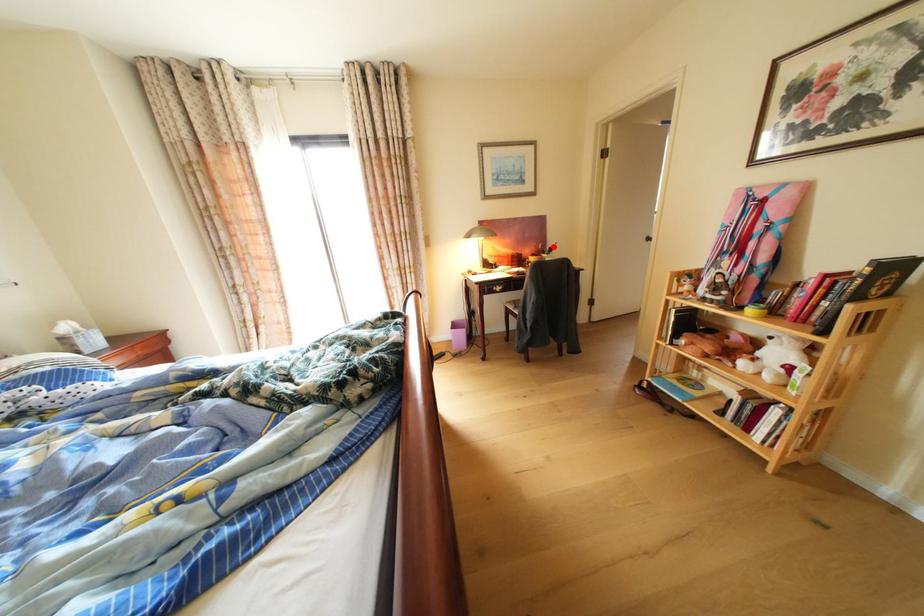
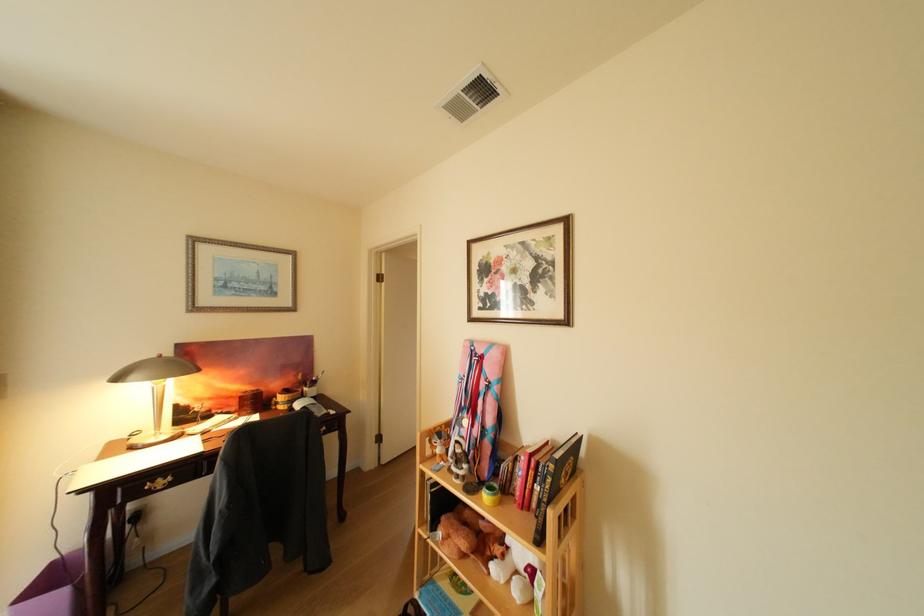
Question: I am providing you with two images of the same scene from different viewpoints. A red point is marked on the first image. At the location where the point appears in image 1, is it still visible in image 2?

Choices:
 (A) Yes
 (B) No

Answer: (A)